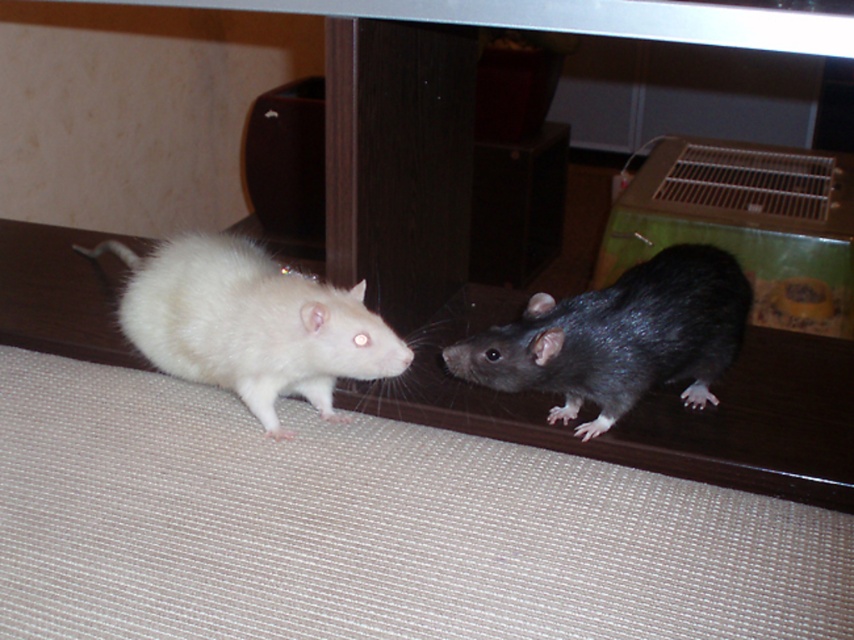
Question: Which object appears closest to the camera in this image?

Choices:
 (A) white furry hamster at left
 (B) shiny black rat at right

Answer: (A)

Question: Which point is farther from the camera taking this photo?

Choices:
 (A) (594, 387)
 (B) (156, 356)

Answer: (B)

Question: Is white furry hamster at left above shiny black rat at right?

Choices:
 (A) yes
 (B) no

Answer: (A)

Question: Is white furry hamster at left thinner than shiny black rat at right?

Choices:
 (A) no
 (B) yes

Answer: (A)

Question: Does white furry hamster at left appear on the left side of shiny black rat at right?

Choices:
 (A) no
 (B) yes

Answer: (B)